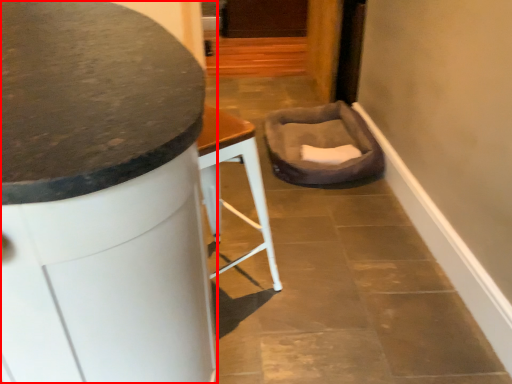
Question: From the image's perspective, where is furniture (annotated by the red box) located relative to swivel chair?

Choices:
 (A) above
 (B) below

Answer: (B)